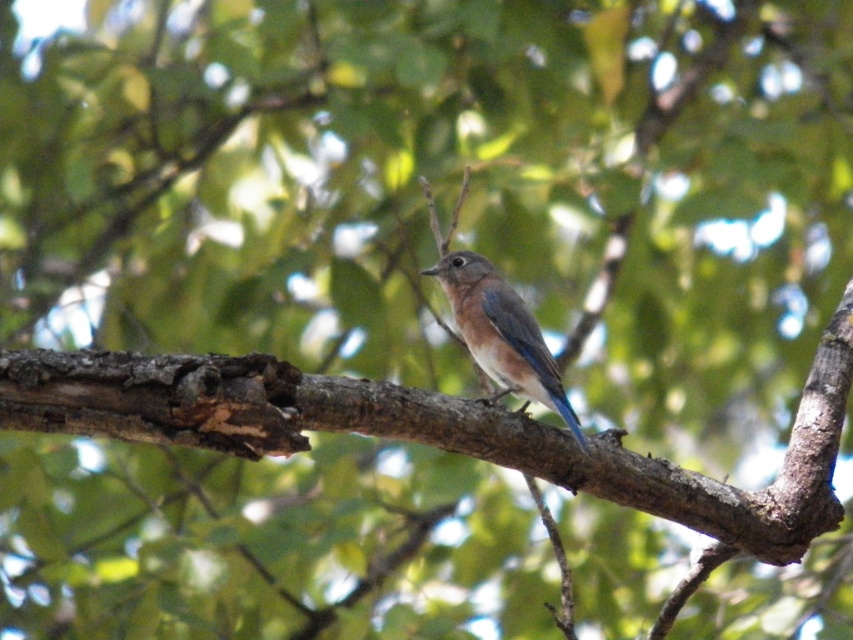
Question: Can you confirm if brown rough tree branch at center is thinner than blue glossy bird at center?

Choices:
 (A) yes
 (B) no

Answer: (B)

Question: Can you confirm if brown rough tree branch at center is thinner than blue glossy bird at center?

Choices:
 (A) no
 (B) yes

Answer: (A)

Question: Which object is farther from the camera taking this photo?

Choices:
 (A) blue glossy bird at center
 (B) brown rough tree branch at center

Answer: (A)

Question: Which point is closer to the camera taking this photo?

Choices:
 (A) (460, 280)
 (B) (440, 394)

Answer: (B)

Question: Is brown rough tree branch at center below blue glossy bird at center?

Choices:
 (A) no
 (B) yes

Answer: (B)